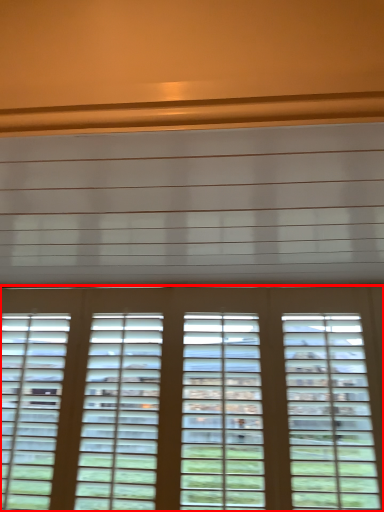
Question: Considering the relative positions of window (annotated by the red box) and blind in the image provided, where is window (annotated by the red box) located with respect to the staircase?

Choices:
 (A) left
 (B) right

Answer: (B)